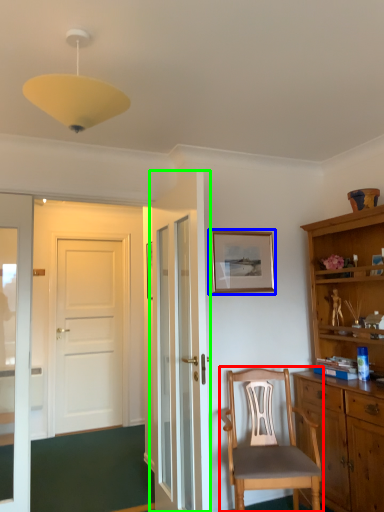
Question: Which is nearer to the chair (highlighted by a red box)? picture frame (highlighted by a blue box) or door (highlighted by a green box).

Choices:
 (A) picture frame
 (B) door

Answer: (B)